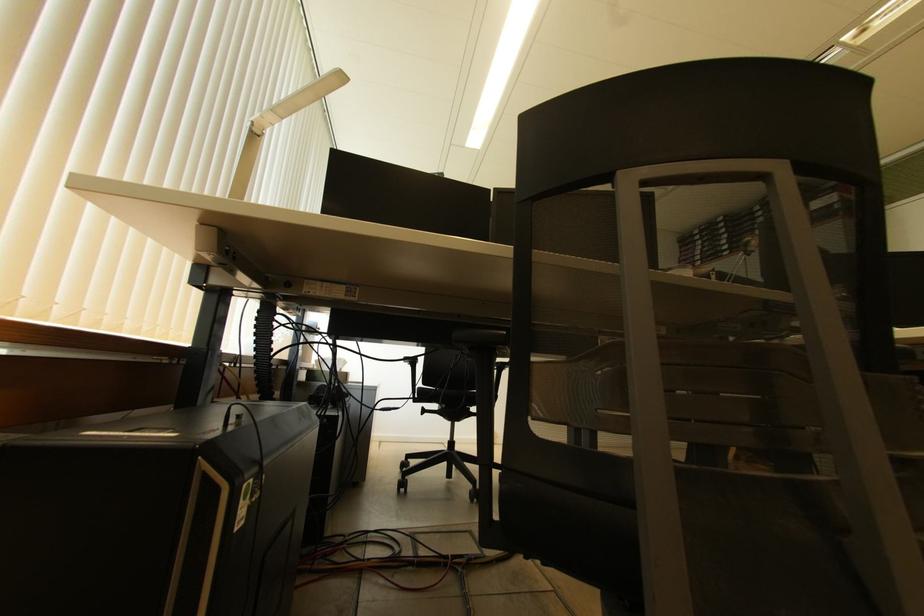
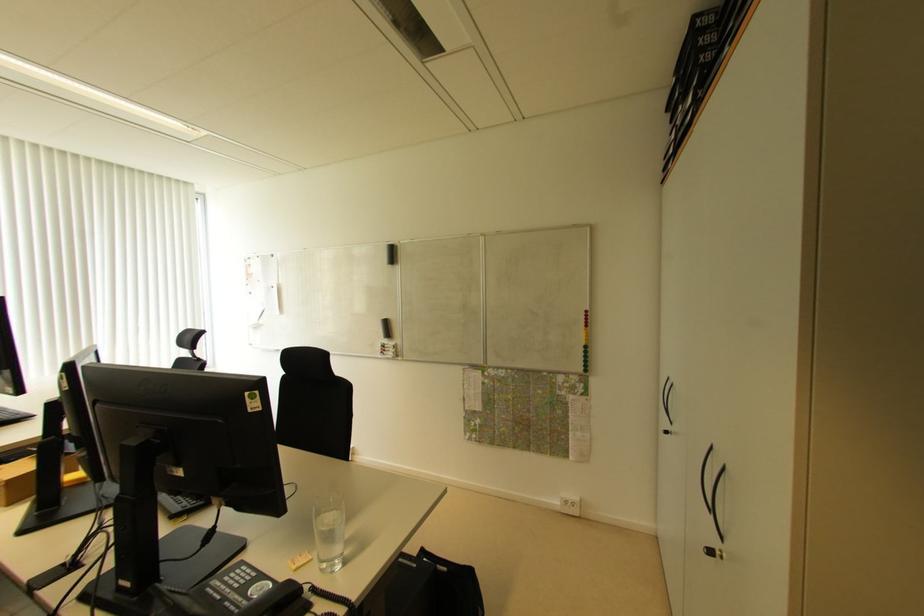
Which direction would the cameraman need to move to produce the second image?

The cameraman walked toward right, forward.